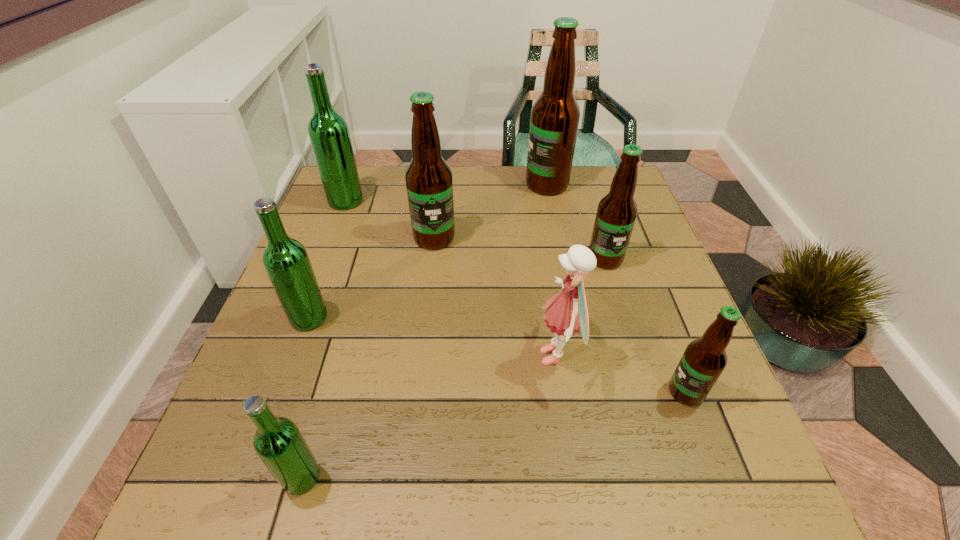
In the image, there is a desktop. In order to click on vacant region at the far edge in this screenshot , I will do `click(401, 185)`.

The height and width of the screenshot is (540, 960). Identify the location of free space at the near edge. (516, 516).

Locate an element on the screen. The width and height of the screenshot is (960, 540). vacant space at the left edge of the desktop is located at coordinates (324, 219).

I want to click on vacant space at the right edge of the desktop, so click(x=666, y=268).

In the image, there is a desktop. Where is `free space at the far left corner`? The width and height of the screenshot is (960, 540). free space at the far left corner is located at coordinates (375, 211).

This screenshot has width=960, height=540. I want to click on vacant space that's between the smallest green beer bottle and the third biggest brown beer bottle, so click(x=453, y=368).

Locate an element on the screen. vacant area that lies between the second biggest green beer bottle and the pink doll is located at coordinates (433, 337).

Identify the location of unoccupied position between the tallest object and the second nearest beer bottle. (616, 288).

This screenshot has width=960, height=540. In order to click on unoccupied position between the nearest brown beer bottle and the fifth beer bottle from right to left in this screenshot , I will do `click(493, 434)`.

You are a GUI agent. You are given a task and a screenshot of the screen. Output one action in this format:
    pyautogui.click(x=<x>, y=<y>)
    Task: Click on the free area in between the second smallest brown beer bottle and the nearest brown beer bottle
    
    Given the screenshot: What is the action you would take?
    pyautogui.click(x=645, y=325)